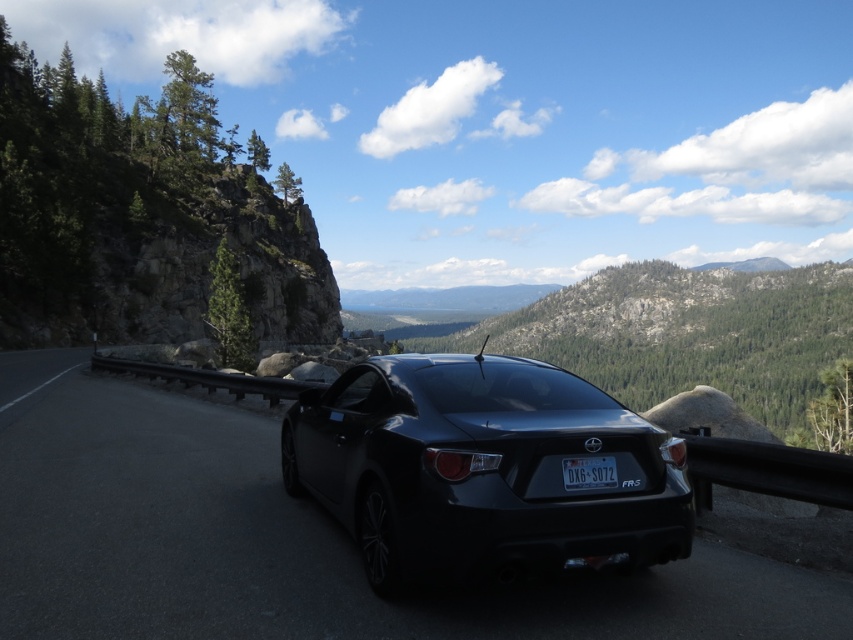
Does point (263, 547) come closer to viewer compared to point (508, 436)?

No, it is not.

Who is more forward, (164,628) or (604,538)?

Positioned in front is point (164,628).

Between point (380, 600) and point (390, 392), which one is positioned in front?

Point (380, 600)

I want to click on black glossy car at center, so click(288, 540).

Does point (225, 566) come closer to viewer compared to point (576, 458)?

No, it is behind (576, 458).

Between black glossy car at center and black plastic license plate at center, which one appears on the right side from the viewer's perspective?

black plastic license plate at center is more to the right.

Does point (306, 563) come behind point (606, 483)?

Yes, it is.

Find the location of a particular element. The width and height of the screenshot is (853, 640). black glossy car at center is located at coordinates (288, 540).

Consider the image. Does glossy black car at center come in front of black plastic license plate at center?

Yes.

Looking at this image, is glossy black car at center smaller than black plastic license plate at center?

Actually, glossy black car at center might be larger than black plastic license plate at center.

Is point (529, 374) behind point (596, 483)?

That is True.

Identify the location of glossy black car at center. (482, 468).